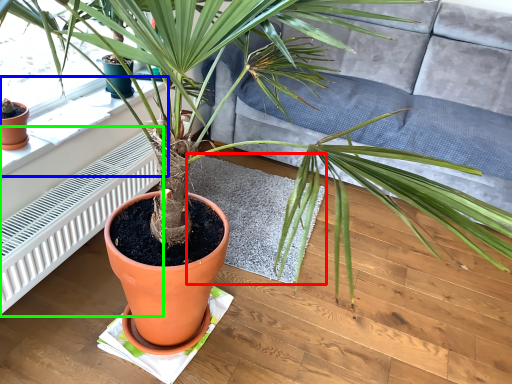
Question: Which object is the closest to the mat (highlighted by a red box)? Choose among these: window sill (highlighted by a blue box) or radiator (highlighted by a green box).

Choices:
 (A) window sill
 (B) radiator

Answer: (B)